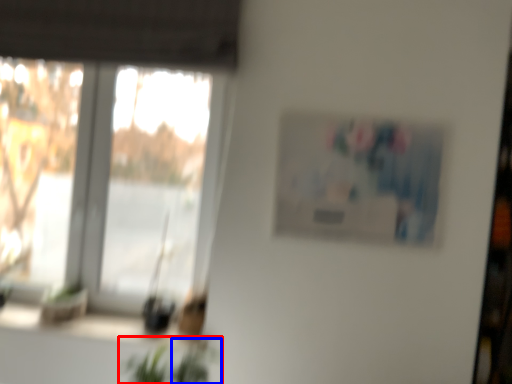
Question: Which object is further to the camera taking this photo, houseplant (highlighted by a red box) or plant (highlighted by a blue box)?

Choices:
 (A) houseplant
 (B) plant

Answer: (B)